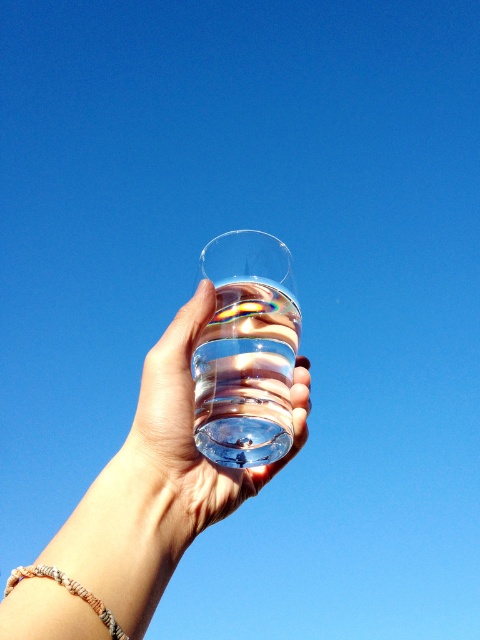
Who is more forward, (176, 547) or (86, 602)?

Point (86, 602) is more forward.

Is point (148, 481) farther from viewer compared to point (13, 582)?

That is True.

What do you see at coordinates (159, 483) in the screenshot? The image size is (480, 640). I see `transparent glass at center` at bounding box center [159, 483].

Identify the location of transparent glass at center. This screenshot has width=480, height=640. (159, 483).

Does transparent glass at center have a greater width compared to clear glass water at center?

Indeed, transparent glass at center has a greater width compared to clear glass water at center.

Which is more to the left, transparent glass at center or clear glass water at center?

transparent glass at center is more to the left.

Where is `transparent glass at center`? transparent glass at center is located at coordinates (159, 483).

I want to click on transparent glass at center, so click(159, 483).

Who is more distant from viewer, [182,547] or [97,602]?

The point [182,547] is more distant.

Is point (179, 321) positioned after point (96, 609)?

Yes.

At what (x,y) coordinates should I click in order to perform the action: click on clear glass water at center. Please return your answer as a coordinate pair (x, y). This screenshot has width=480, height=640. Looking at the image, I should click on (186, 444).

Find the location of a particular element. clear glass water at center is located at coordinates (186, 444).